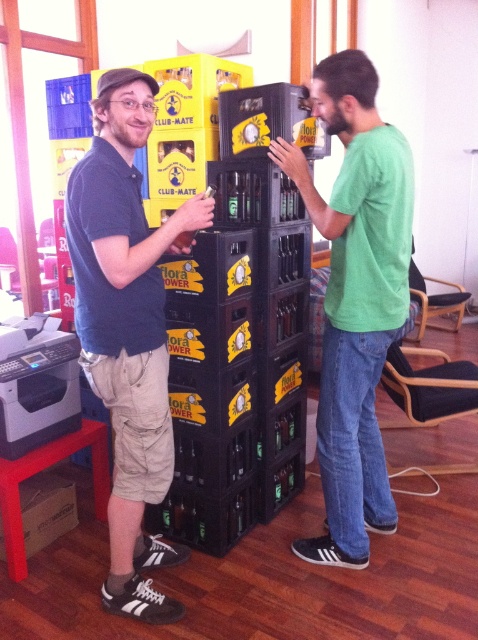
Question: Which point is closer to the camera taking this photo?

Choices:
 (A) (28, 340)
 (B) (82, 420)

Answer: (A)

Question: Considering the relative positions of matte black shirt at left and red plastic stool at lower left in the image provided, where is matte black shirt at left located with respect to red plastic stool at lower left?

Choices:
 (A) left
 (B) right

Answer: (B)

Question: Which is farther from the black matte printer at left?

Choices:
 (A) matte black shirt at left
 (B) red plastic stool at lower left

Answer: (A)

Question: Observing the image, what is the correct spatial positioning of matte black shirt at left in reference to red plastic stool at lower left?

Choices:
 (A) right
 (B) left

Answer: (A)

Question: Is green matte shirt at center positioned before black matte printer at left?

Choices:
 (A) yes
 (B) no

Answer: (A)

Question: Which of the following is the farthest from the observer?

Choices:
 (A) black matte printer at left
 (B) red plastic stool at lower left
 (C) green matte shirt at center
 (D) matte black shirt at left

Answer: (A)